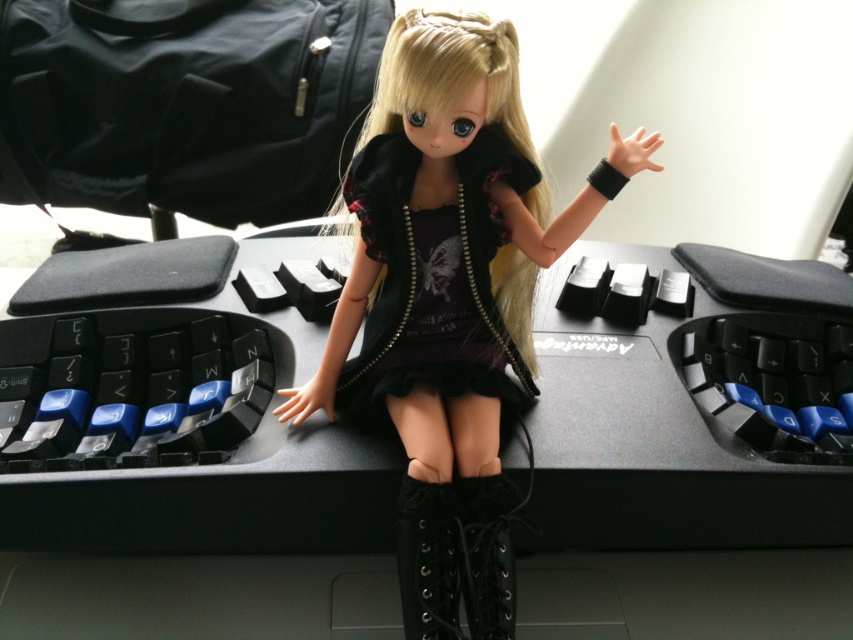
Question: Which point is closer to the camera taking this photo?

Choices:
 (A) (410, 368)
 (B) (726, 499)
 (C) (415, 560)
 (D) (428, 209)

Answer: (C)

Question: Is black matte dress at center in front of black leather boot at center?

Choices:
 (A) no
 (B) yes

Answer: (A)

Question: Which of the following is the farthest from the observer?

Choices:
 (A) matte black doll at center
 (B) black leather boot at center
 (C) black matte computer desk at center

Answer: (C)

Question: Is the position of black matte computer desk at center less distant than that of matte black doll at center?

Choices:
 (A) no
 (B) yes

Answer: (A)

Question: Estimate the real-world distances between objects in this image. Which object is closer to the black leather boot at lower center?

Choices:
 (A) black matte dress at center
 (B) black matte computer desk at center
 (C) black leather boot at center

Answer: (C)

Question: Does black matte dress at center have a smaller size compared to black leather boot at center?

Choices:
 (A) yes
 (B) no

Answer: (B)